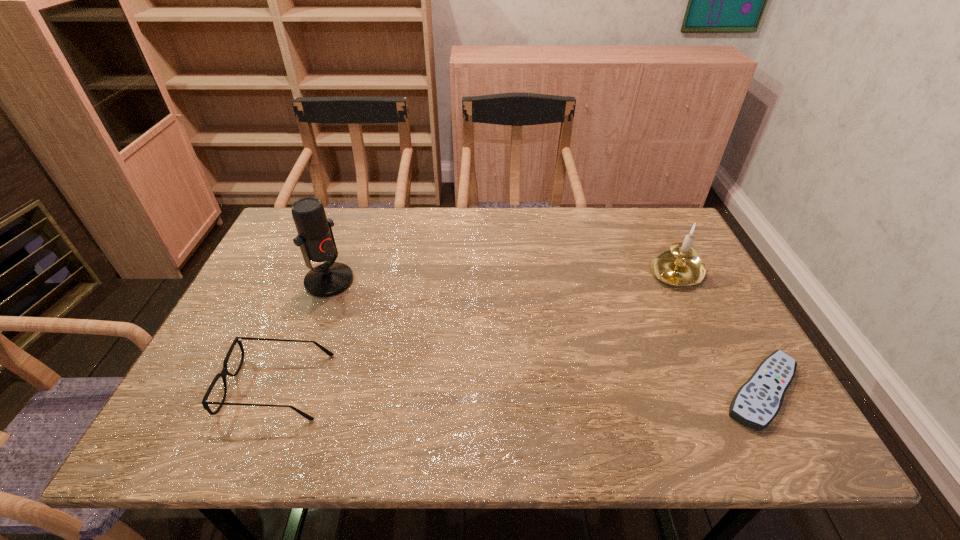
Where is `free space on the desktop that is between the spectacles and the remote control and is positioned on the handle side of the third shortest object`? The image size is (960, 540). free space on the desktop that is between the spectacles and the remote control and is positioned on the handle side of the third shortest object is located at coordinates tap(524, 389).

This screenshot has width=960, height=540. Identify the location of vacant spot on the desktop that is between the spectacles and the shortest object and is positioned on the side of the tallest object with the red ring. (505, 388).